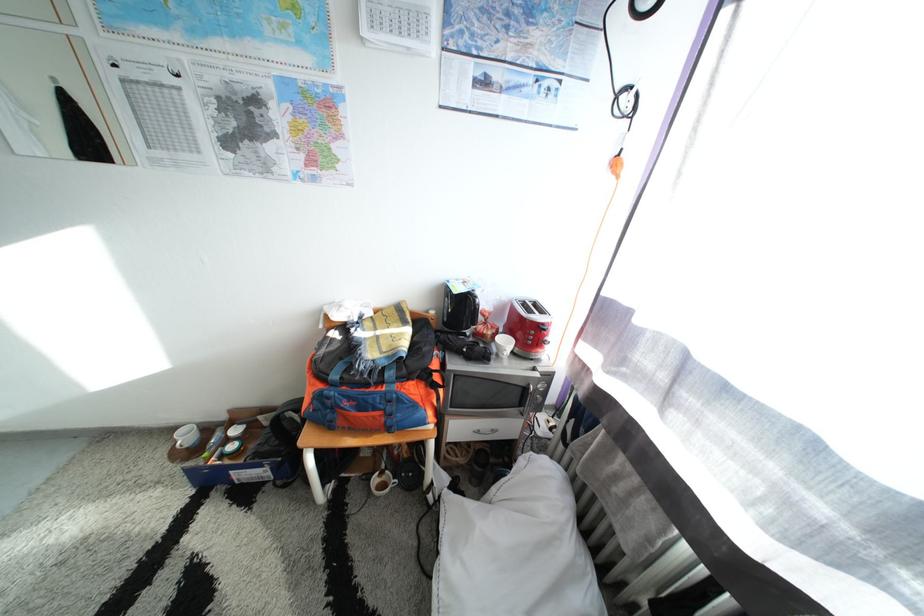
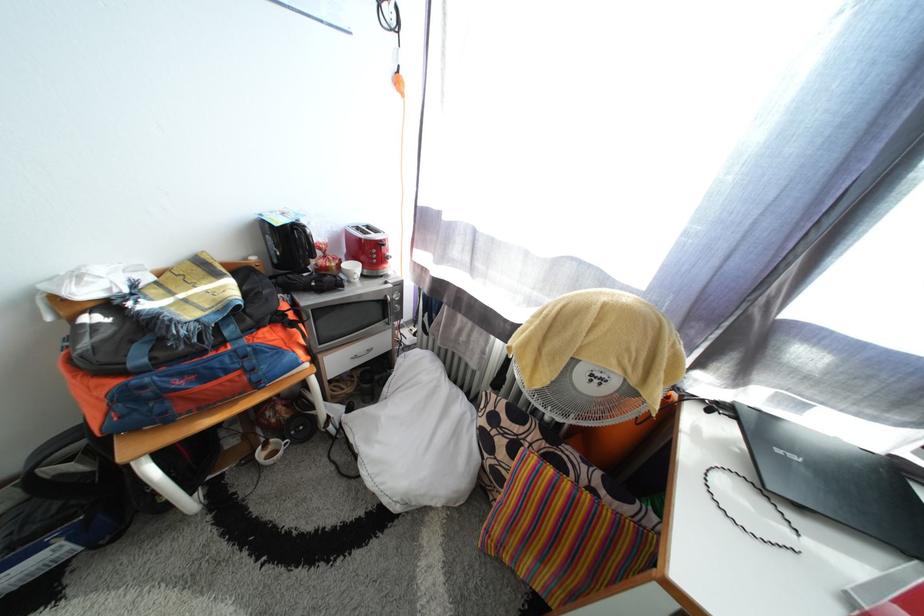
In the second image, find the point that corresponds to point 393,485 in the first image.

(280, 455)